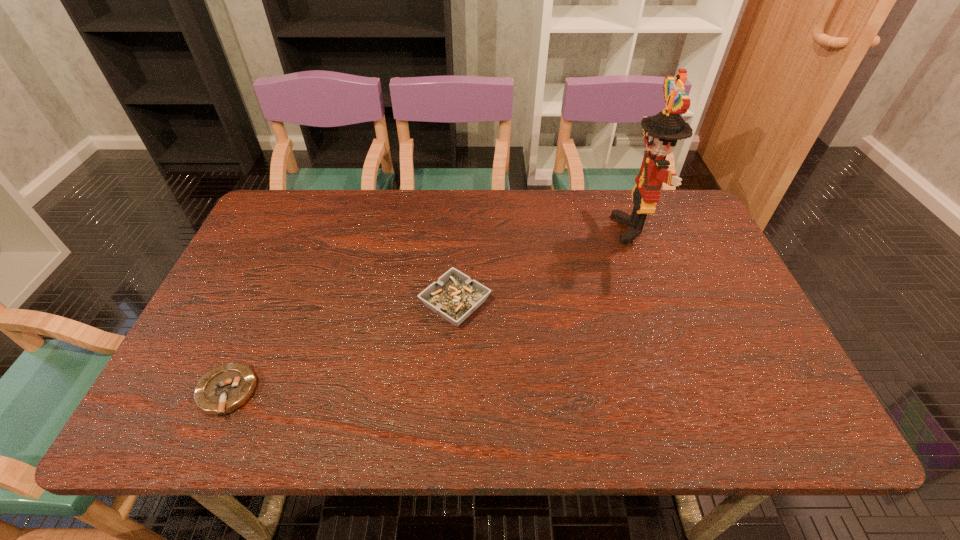
Locate an element on the screen. The height and width of the screenshot is (540, 960). the rightmost object is located at coordinates (661, 132).

The image size is (960, 540). Identify the location of the tallest object. 661,132.

In order to click on the second object from right to left in this screenshot , I will do `click(454, 296)`.

Find the location of a particular element. The image size is (960, 540). the second shortest object is located at coordinates (454, 296).

Where is `the shorter ashtray`? the shorter ashtray is located at coordinates (224, 389).

Where is `the left ashtray`? This screenshot has width=960, height=540. the left ashtray is located at coordinates (224, 389).

Where is `vacant space located 0.210m on the front-facing side of the farthest object`? The width and height of the screenshot is (960, 540). vacant space located 0.210m on the front-facing side of the farthest object is located at coordinates (545, 229).

You are a GUI agent. You are given a task and a screenshot of the screen. Output one action in this format:
    pyautogui.click(x=<x>, y=<y>)
    Task: Click on the free space located 0.060m on the front-facing side of the farthest object
    Image resolution: width=960 pixels, height=540 pixels.
    Given the screenshot: What is the action you would take?
    pyautogui.click(x=595, y=229)

Where is `free space located on the front-facing side of the farthest object`? This screenshot has width=960, height=540. free space located on the front-facing side of the farthest object is located at coordinates (572, 229).

Locate an element on the screen. The image size is (960, 540). free point located on the left of the right ashtray is located at coordinates (309, 303).